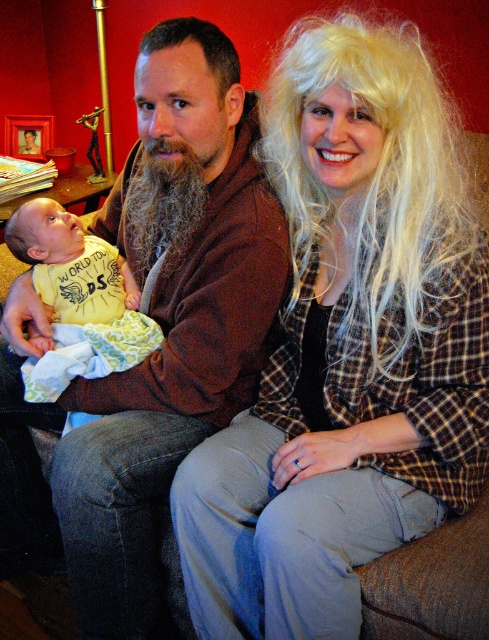
Question: Is blonde hair at center to the right of yellow cotton bib at center from the viewer's perspective?

Choices:
 (A) yes
 (B) no

Answer: (A)

Question: Which object is the closest to the yellow cotton bib at center?

Choices:
 (A) brown soft sweater at center
 (B) blonde hair at center

Answer: (A)

Question: Which object is the farthest from the brown soft sweater at center?

Choices:
 (A) yellow cotton bib at center
 (B) blonde hair at center

Answer: (B)

Question: Estimate the real-world distances between objects in this image. Which object is farther from the yellow cotton bib at center?

Choices:
 (A) blonde hair at center
 (B) brown soft sweater at center

Answer: (A)

Question: From the image, what is the correct spatial relationship of brown soft sweater at center in relation to yellow cotton bib at center?

Choices:
 (A) above
 (B) below

Answer: (B)

Question: Does blonde hair at center lie in front of brown soft sweater at center?

Choices:
 (A) no
 (B) yes

Answer: (B)